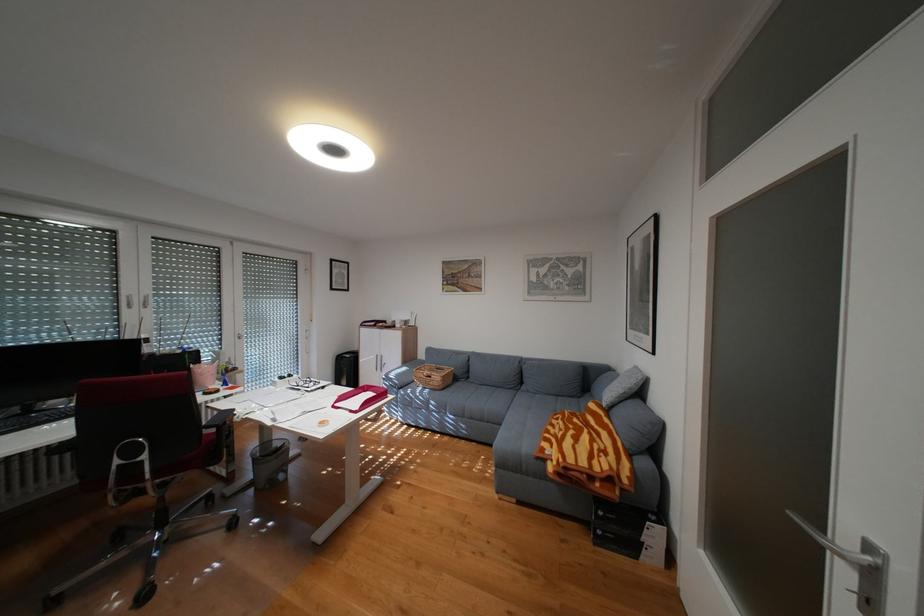
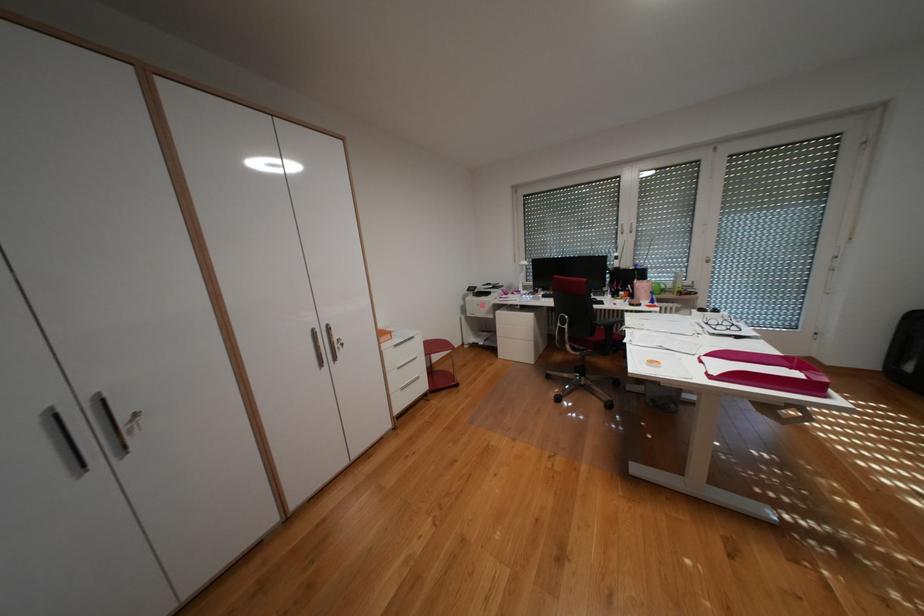
Where in the second image is the point corresponding to point (368, 411) from the first image?

(723, 377)